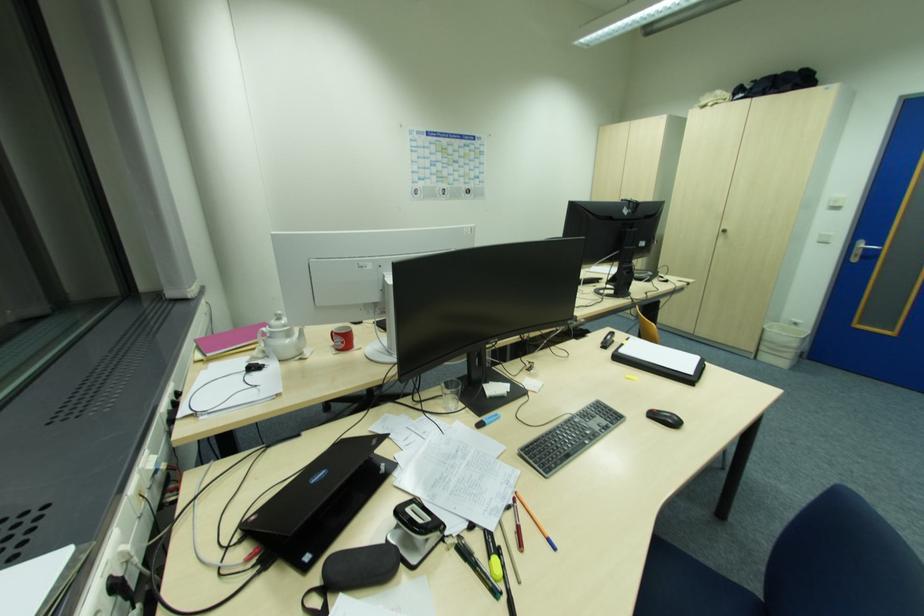
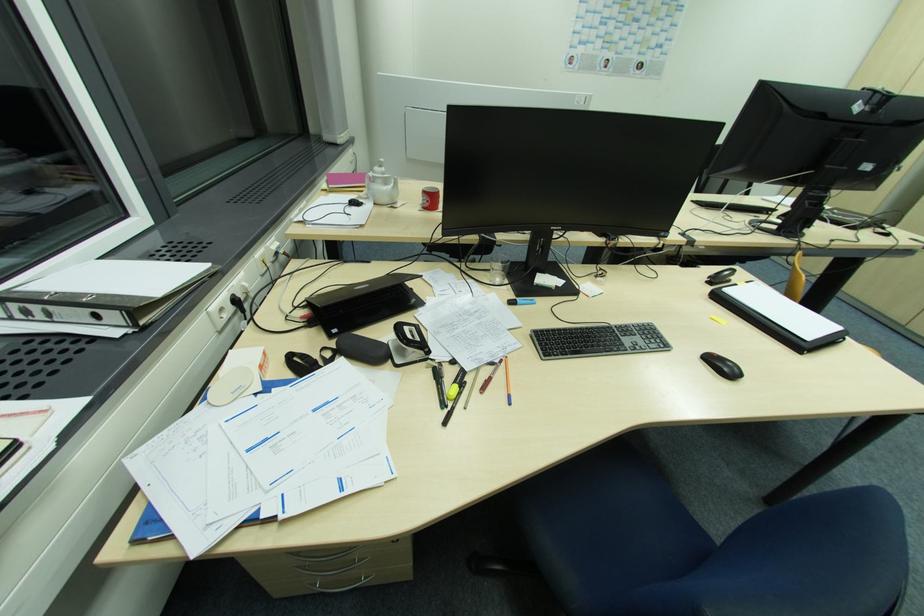
Locate, in the second image, the point that corresponds to [383,467] in the first image.

(416, 302)